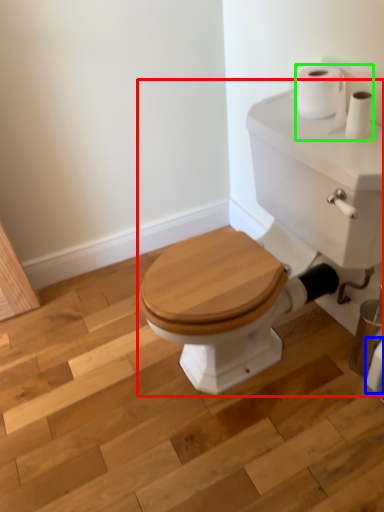
Question: Which object is positioned closest to porcelain (highlighted by a red box)? Select from toilet paper (highlighted by a blue box) and toilet paper (highlighted by a green box).

Choices:
 (A) toilet paper
 (B) toilet paper

Answer: (B)